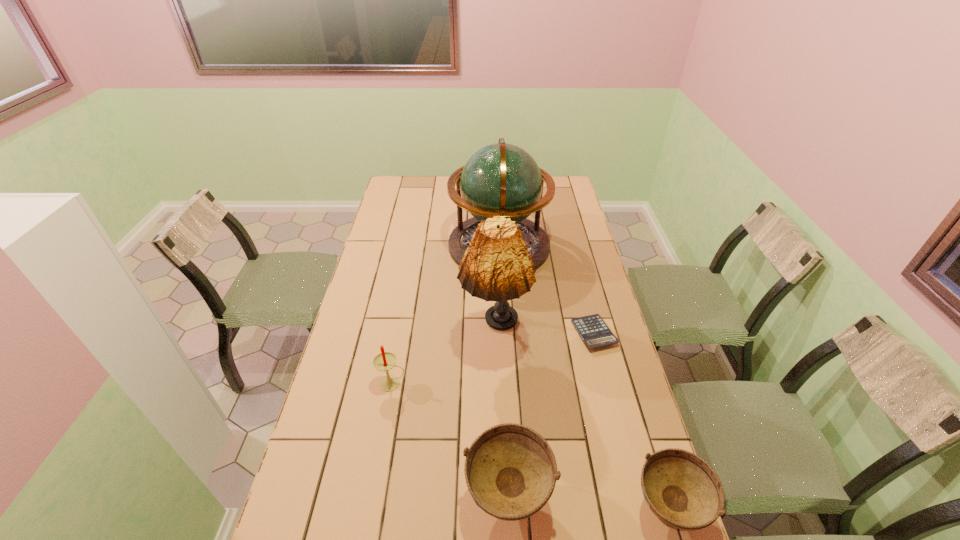
Locate an element on the screen. The width and height of the screenshot is (960, 540). the shortest object is located at coordinates (593, 330).

You are a GUI agent. You are given a task and a screenshot of the screen. Output one action in this format:
    pyautogui.click(x=<x>, y=<y>)
    Task: Click on the globe
    This screenshot has height=540, width=960.
    Given the screenshot: What is the action you would take?
    pyautogui.click(x=501, y=179)

Find the location of a particular element. The height and width of the screenshot is (540, 960). lampshade is located at coordinates (497, 266).

What are the coordinates of `candle` in the screenshot? It's located at (384, 361).

The height and width of the screenshot is (540, 960). I want to click on the fourth farthest object, so click(x=384, y=361).

At what (x,y) coordinates should I click in order to perform the action: click on free spot located 0.340m on the left of the shortest object. Please return your answer as a coordinate pair (x, y). Looking at the image, I should click on (473, 333).

This screenshot has height=540, width=960. I want to click on vacant space located on the front-facing side of the farthest object, so pyautogui.click(x=396, y=246).

Where is `vacant space located on the front-facing side of the farthest object`? This screenshot has width=960, height=540. vacant space located on the front-facing side of the farthest object is located at coordinates (427, 246).

This screenshot has height=540, width=960. What are the coordinates of `vacant space located 0.200m on the front-facing side of the farthest object` in the screenshot? It's located at (401, 246).

The height and width of the screenshot is (540, 960). I want to click on free location located on the front-facing side of the lampshade, so click(x=496, y=382).